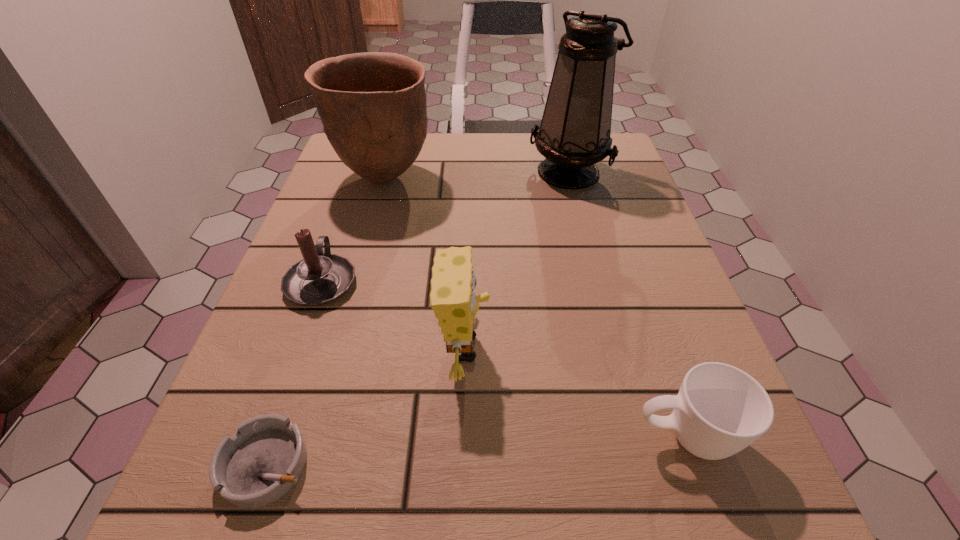
Identify the location of blank region between the second tallest object and the oil lamp. The image size is (960, 540). (476, 174).

Find the location of a particular element. This screenshot has height=540, width=960. empty space between the third object from right to left and the fifth shortest object is located at coordinates (424, 263).

The width and height of the screenshot is (960, 540). In order to click on unoccupied position between the ashtray and the candle in this screenshot , I will do `click(295, 373)`.

Where is `free space between the tallest object and the fourth tallest object`? This screenshot has width=960, height=540. free space between the tallest object and the fourth tallest object is located at coordinates (445, 226).

Find the location of a particular element. This screenshot has height=540, width=960. object that can be found as the fifth closest to the second tallest object is located at coordinates (719, 410).

Image resolution: width=960 pixels, height=540 pixels. I want to click on object that is the fifth closest to the pottery, so [x=719, y=410].

Identify the location of free space that satisfies the following two spatial constraints: 1. on the side of the second tallest object with the handle loop; 2. on the right side of the third shortest object. The image size is (960, 540). (359, 178).

This screenshot has width=960, height=540. Identify the location of vacant space that satisfies the following two spatial constraints: 1. with the handle on the side of the second shortest object; 2. on the front side of the shortest object. (693, 464).

Find the location of `vacant space that satisfies the following two spatial constraints: 1. on the back side of the ashtray; 2. on the right side of the tallest object`. vacant space that satisfies the following two spatial constraints: 1. on the back side of the ashtray; 2. on the right side of the tallest object is located at coordinates (366, 171).

The width and height of the screenshot is (960, 540). In order to click on vacant space that satisfies the following two spatial constraints: 1. on the side of the pottery with the handle loop; 2. on the left side of the candle in this screenshot , I will do `click(359, 178)`.